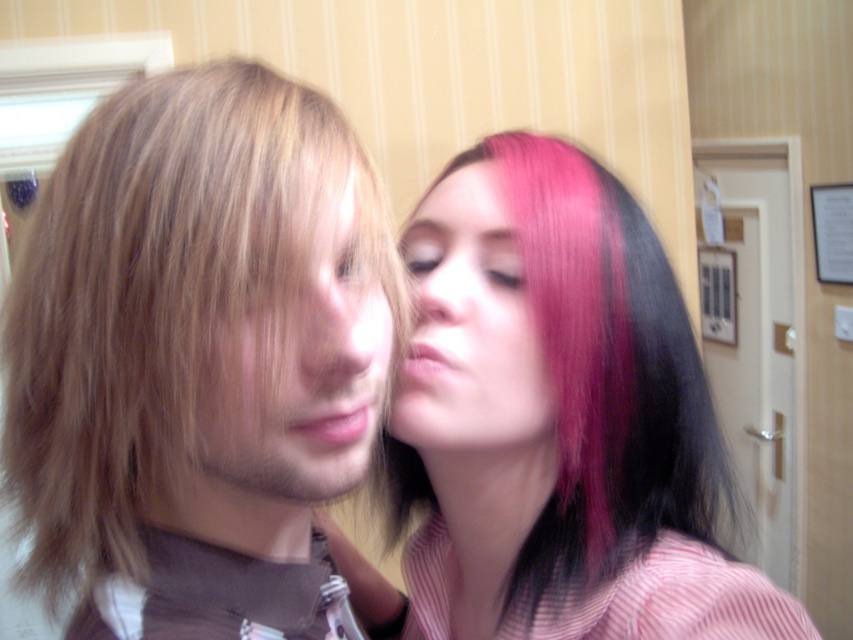
Question: Is blonde hair at center to the left of pink hair at center from the viewer's perspective?

Choices:
 (A) no
 (B) yes

Answer: (B)

Question: Is matte pink nose at center below pink matte hair at upper center?

Choices:
 (A) no
 (B) yes

Answer: (B)

Question: Which of the following is the farthest from the observer?

Choices:
 (A) shiny pink hair at center
 (B) matte pink nose at center
 (C) pink hair at center

Answer: (B)

Question: Can you confirm if blonde hair at left is thinner than shiny pink hair at center?

Choices:
 (A) yes
 (B) no

Answer: (A)

Question: Which object is closer to the camera taking this photo?

Choices:
 (A) blonde hair at left
 (B) matte skin nose at center
 (C) pink hair at center

Answer: (A)

Question: Which point appears closest to the camera in this image?

Choices:
 (A) (277, 289)
 (B) (457, 321)

Answer: (A)